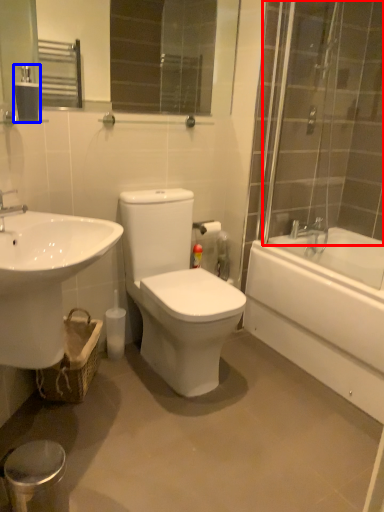
Question: Which object appears farthest to the camera in this image, shower door (highlighted by a red box) or tissue (highlighted by a blue box)?

Choices:
 (A) shower door
 (B) tissue

Answer: (B)